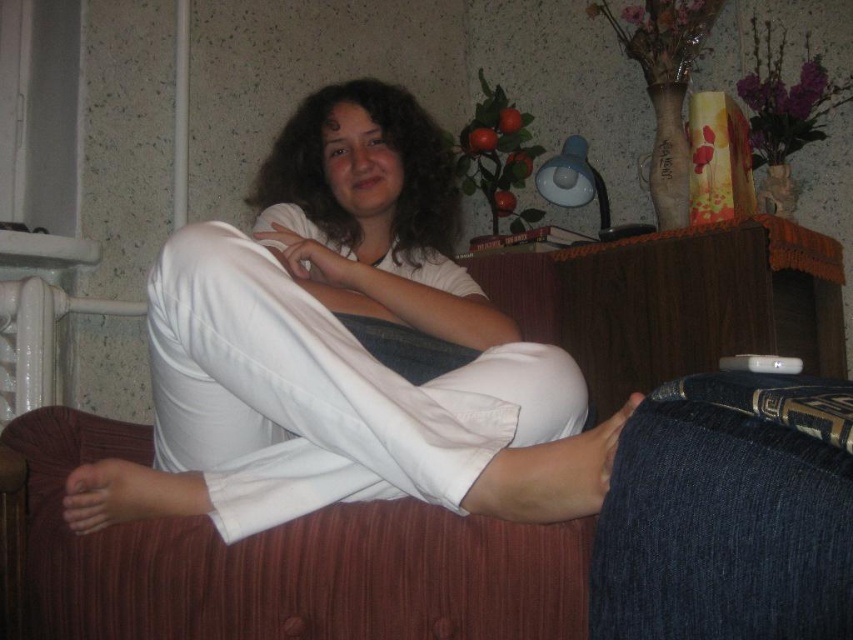
Question: Which point is closer to the camera?

Choices:
 (A) (795, 614)
 (B) (15, 410)

Answer: (A)

Question: Which point is closer to the camera taking this photo?

Choices:
 (A) (621, 470)
 (B) (59, 595)
 (C) (36, 305)
 (D) (194, 444)

Answer: (A)

Question: Does white cotton pants at center have a lesser width compared to white plastic radiator at left?

Choices:
 (A) yes
 (B) no

Answer: (B)

Question: Can you confirm if white cotton pants at center is positioned to the right of velvet-like red couch at lower left?

Choices:
 (A) no
 (B) yes

Answer: (B)

Question: Which point appears farthest from the camera in this image?

Choices:
 (A) (395, 156)
 (B) (54, 323)
 (C) (540, 532)

Answer: (B)

Question: Does wooden dresser at center have a smaller size compared to white plastic radiator at left?

Choices:
 (A) no
 (B) yes

Answer: (A)